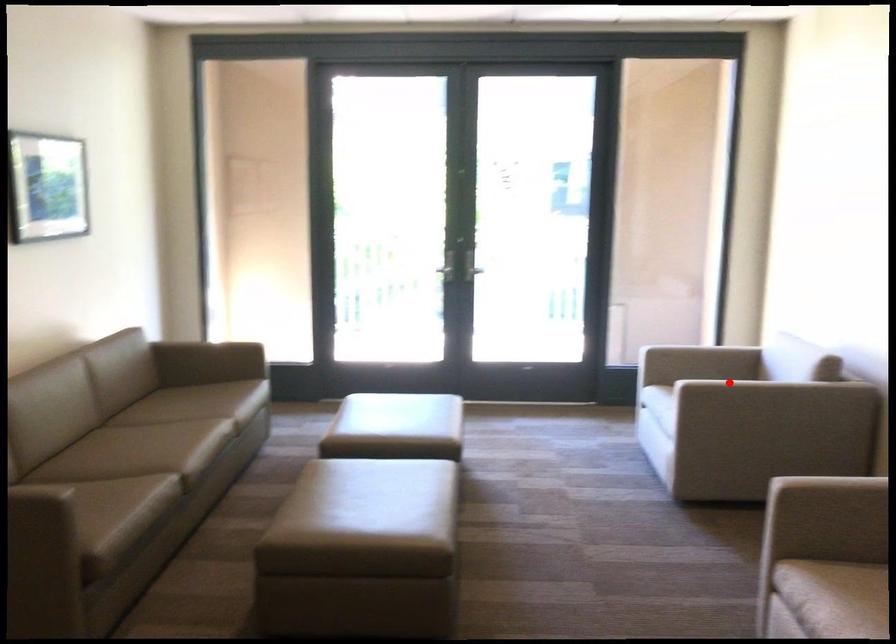
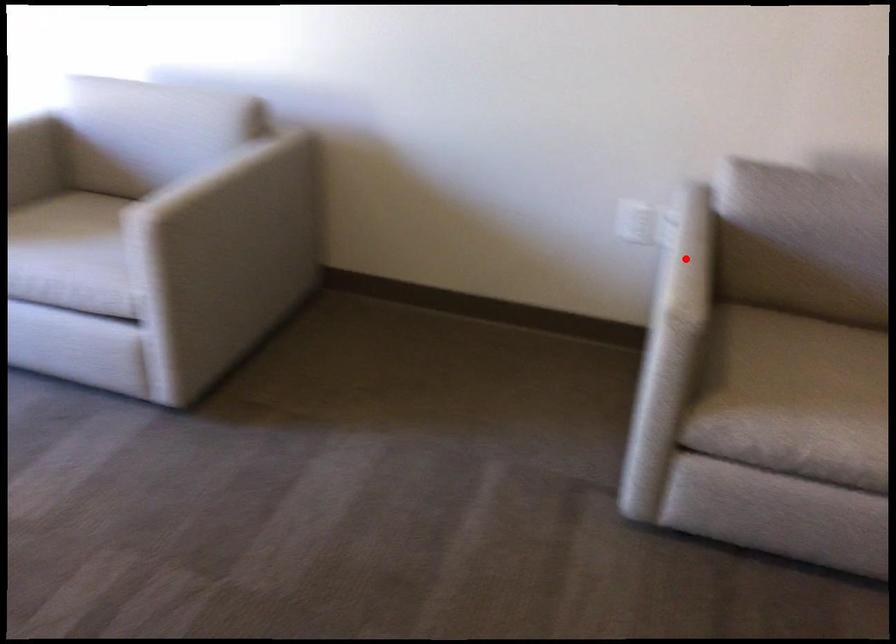
I am providing you with two images of the same scene from different viewpoints. A red point is marked on the first image and another point is marked on the second image. Does the point marked in image1 correspond to the same location as the one in image2?

No